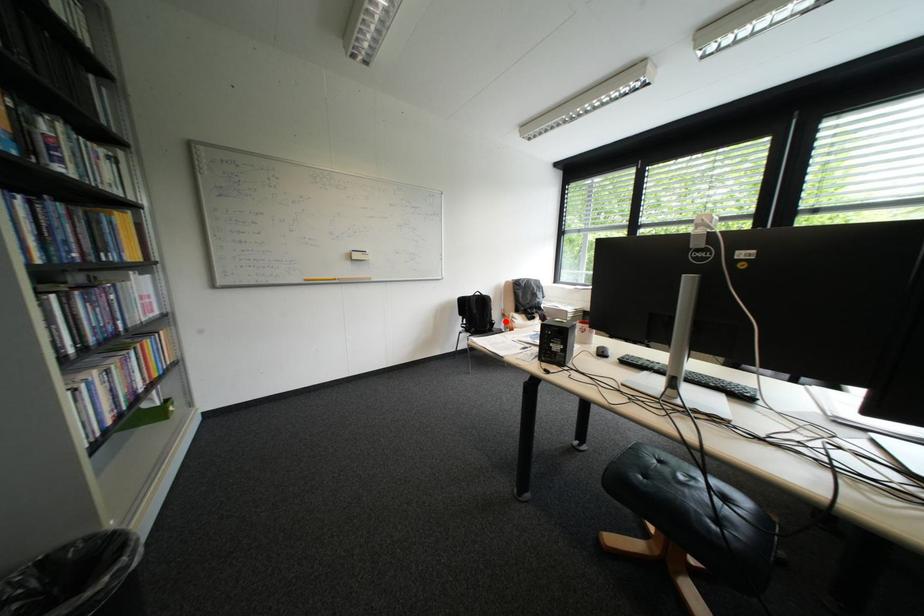
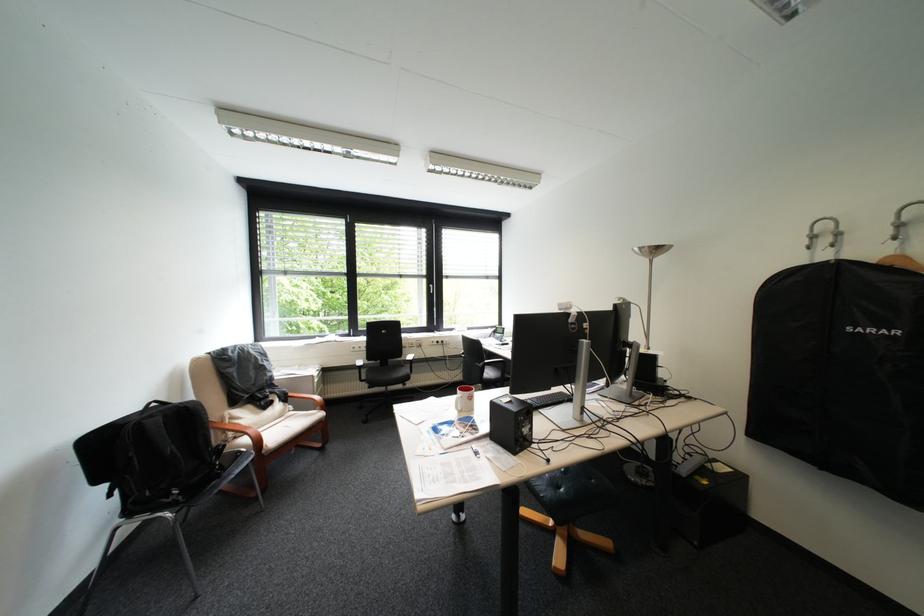
Question: I am providing you with two images of the same scene from different viewpoints. Image1 has a red point marked. In image2, the corresponding 3D location appears at what relative position? Reply with the corresponding letter.

Choices:
 (A) Closer
 (B) Farther

Answer: (A)